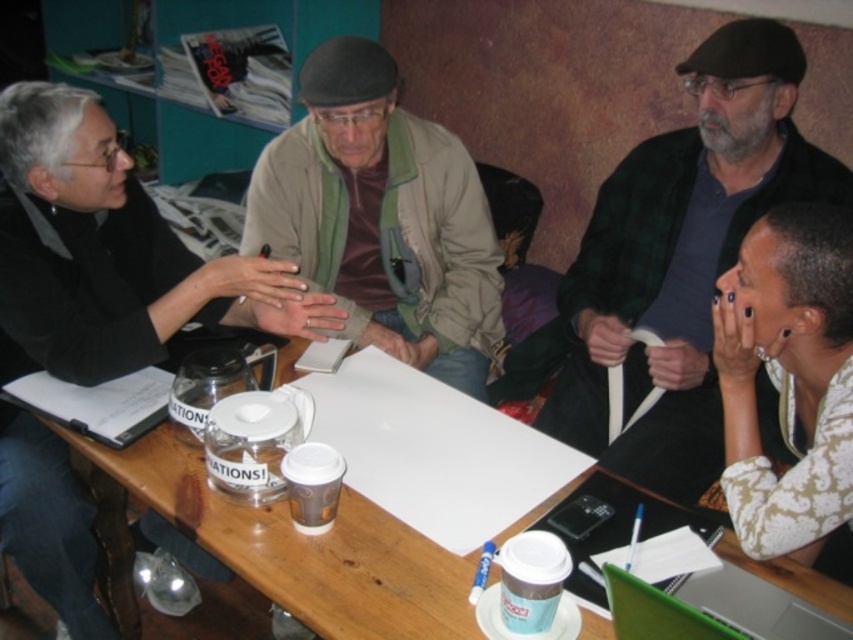
You are standing at the center of the table and want to reach both point A at point (738, 550) and point B at point (793, 628). Which point is closer to you?

Point A at point (738, 550) is closer to you because it is further to the viewer than point B at point (793, 628).

You are standing at the point labeled as point (753, 264) and want to walk to the point labeled as point (30, 324). Which direction should you move in to reach your destination?

To reach point (30, 324) from point (753, 264), you should move downward because point (30, 324) is behind point (753, 264).